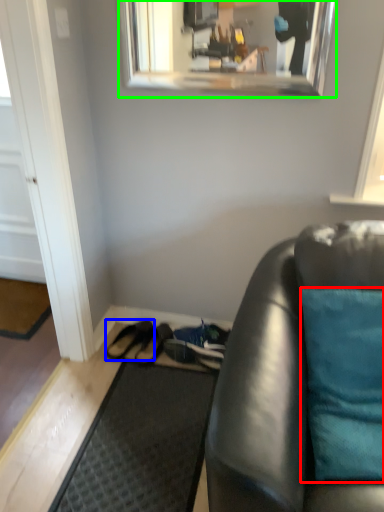
Question: Which object is the closest to the pillow (highlighted by a red box)? Choose among these: footwear (highlighted by a blue box) or mirror (highlighted by a green box).

Choices:
 (A) footwear
 (B) mirror

Answer: (A)